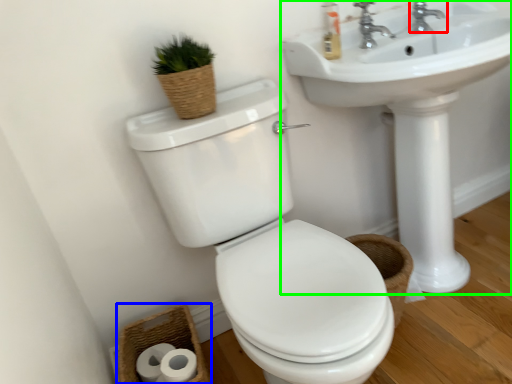
Question: Based on their relative distances, which object is nearer to tap (highlighted by a red box)? Choose from basket (highlighted by a blue box) and sink (highlighted by a green box).

Choices:
 (A) basket
 (B) sink

Answer: (B)